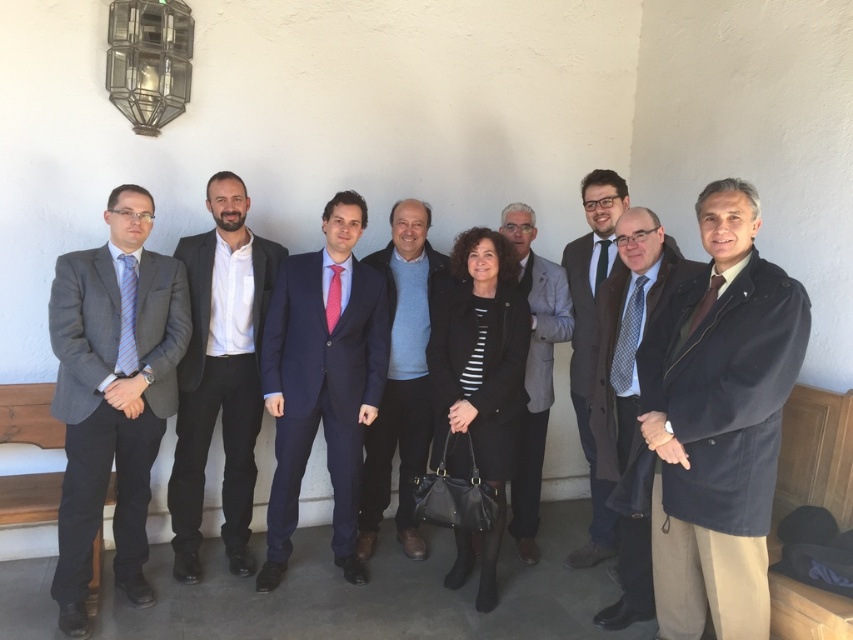
Can you confirm if navy blue suit at center is smaller than matte black suit at center?

Yes.

This screenshot has width=853, height=640. What do you see at coordinates (322, 380) in the screenshot? I see `navy blue suit at center` at bounding box center [322, 380].

Is point (341, 445) less distant than point (209, 390)?

Yes, it is in front of point (209, 390).

This screenshot has height=640, width=853. I want to click on navy blue suit at center, so click(322, 380).

Which of these two, dark brown leather coat at center or dark brown woolen coat at center, stands shorter?

dark brown woolen coat at center

Who is positioned more to the left, dark brown leather coat at center or dark brown woolen coat at center?

dark brown leather coat at center is more to the left.

At what (x,y) coordinates should I click in order to perform the action: click on dark brown leather coat at center. Please return your answer as a coordinate pair (x, y). Looking at the image, I should click on (590, 340).

This screenshot has height=640, width=853. Find the location of `dark brown leather coat at center`. dark brown leather coat at center is located at coordinates (590, 340).

Between point (669, 536) and point (419, 208), which one is positioned behind?

The point (419, 208) is more distant.

Between dark brown wool coat at right and blue sweater at center, which one is positioned higher?

blue sweater at center

Does point (766, 532) come closer to viewer compared to point (372, 534)?

Yes.

The width and height of the screenshot is (853, 640). In order to click on dark brown wool coat at right in this screenshot , I will do pyautogui.click(x=721, y=422).